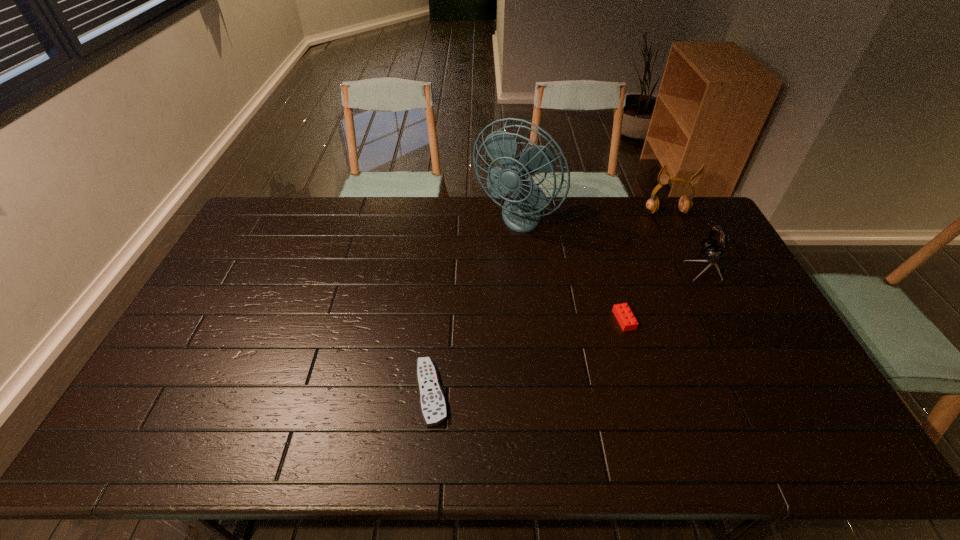
The width and height of the screenshot is (960, 540). I want to click on free area in between the farther earphone and the Lego, so click(x=645, y=266).

In order to click on free space between the third tallest object and the second tallest object in this screenshot , I will do `click(686, 240)`.

You are a GUI agent. You are given a task and a screenshot of the screen. Output one action in this format:
    pyautogui.click(x=<x>, y=<y>)
    Task: Click on the blank region between the shortest object and the tallest object
    The width and height of the screenshot is (960, 540).
    Given the screenshot: What is the action you would take?
    pyautogui.click(x=473, y=306)

Locate an element on the screen. The image size is (960, 540). empty location between the fan and the leftmost object is located at coordinates (473, 306).

The width and height of the screenshot is (960, 540). I want to click on empty location between the fourth shortest object and the fourth farthest object, so click(x=645, y=266).

Find the location of `free spot between the fourth shortest object and the fan`. free spot between the fourth shortest object and the fan is located at coordinates (590, 216).

The image size is (960, 540). I want to click on blank region between the taller earphone and the shorter earphone, so click(x=686, y=240).

Select which object is the third closest to the shorter earphone. Please provide its 2D coordinates. Your answer should be formatted as a tuple, i.e. [(x, y)], where the tuple contains the x and y coordinates of a point satisfying the conditions above.

[(521, 212)]

You are a GUI agent. You are given a task and a screenshot of the screen. Output one action in this format:
    pyautogui.click(x=<x>, y=<y>)
    Task: Click on the object that is the third nearest to the leftmost object
    The image size is (960, 540).
    Given the screenshot: What is the action you would take?
    pyautogui.click(x=712, y=252)

Identify the location of free space that satisfies the following two spatial constraints: 1. on the front-facing side of the farther earphone; 2. on the right side of the third shortest object. The height and width of the screenshot is (540, 960). (695, 268).